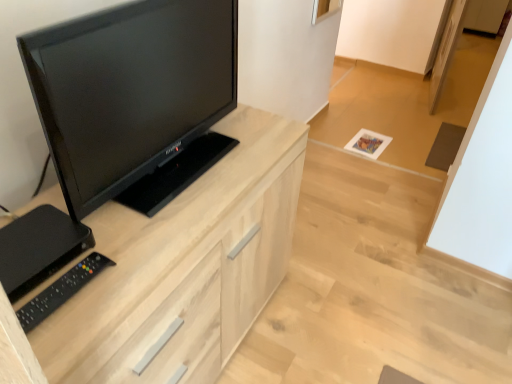
The width and height of the screenshot is (512, 384). Identify the location of free space to the back side of black plastic remote at lower left. (123, 225).